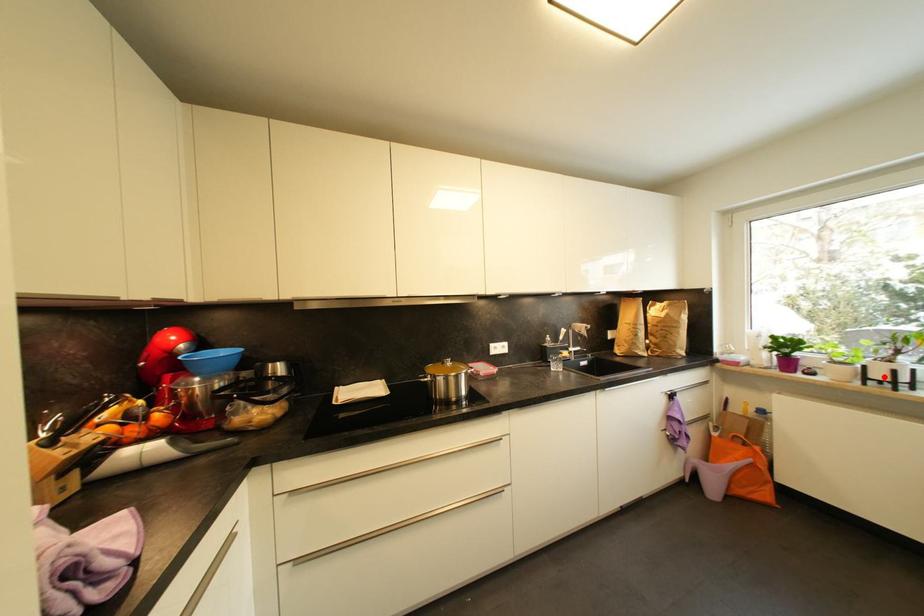
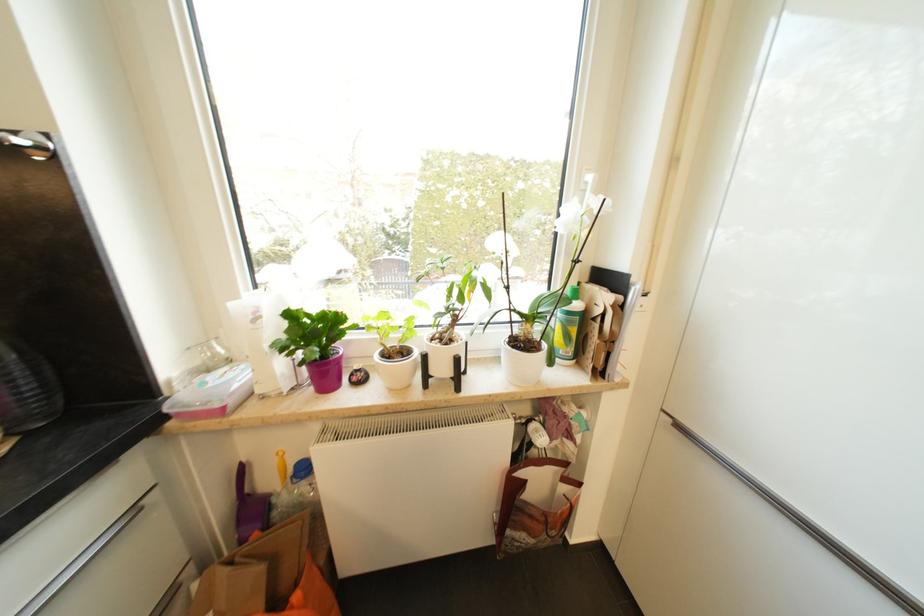
The point at the highlighted location is marked in the first image. Where is the corresponding point in the second image?

(446, 371)